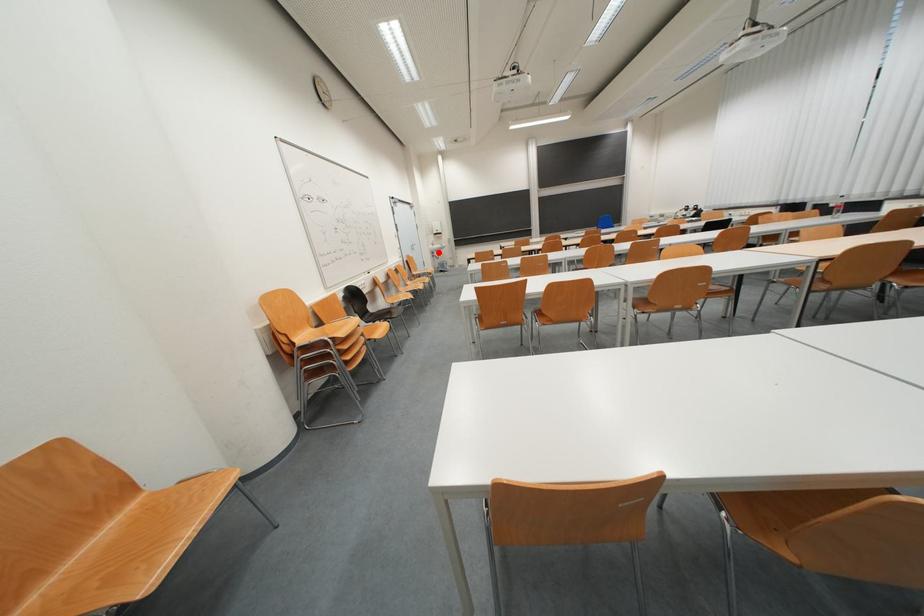
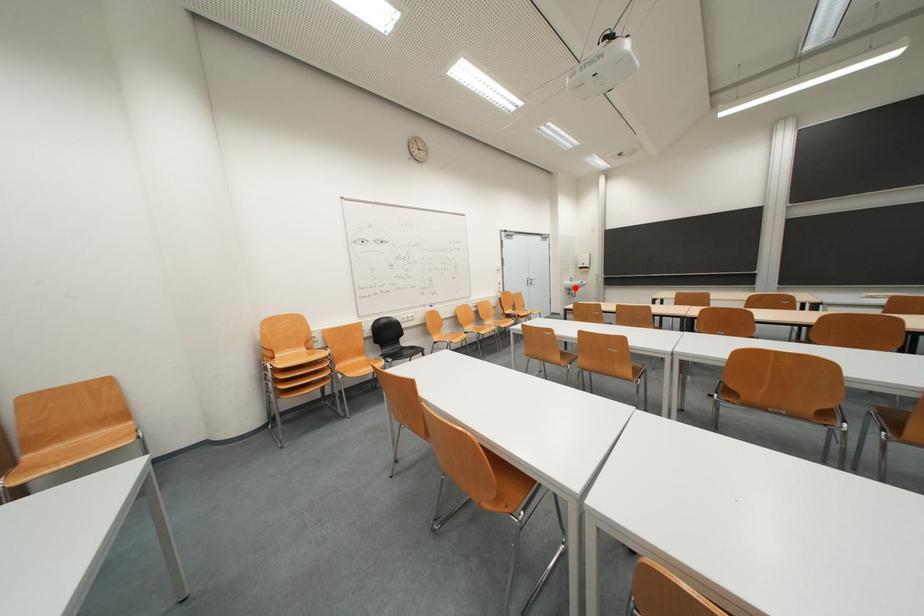
I am providing you with two images of the same scene from different viewpoints. A red point is marked on the first image and another point is marked on the second image. Does the point marked in image1 correspond to the same location as the one in image2?

Yes